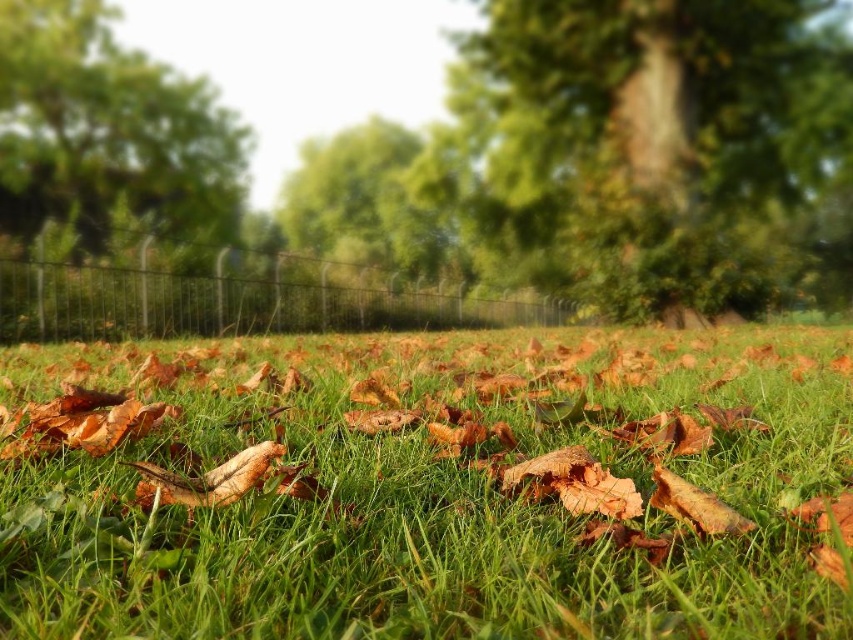
You are standing in the park looking at the scene. You see the green leafy tree at upper left and the black wire fence at center. Which object is positioned more to the left side of the image?

The green leafy tree at upper left is positioned more to the left side of the image than the black wire fence at center.